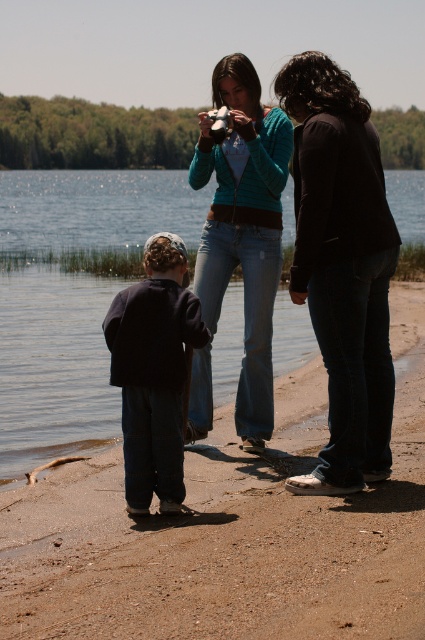
Question: Is black matte pants at right bigger than dark blue fabric at center?

Choices:
 (A) no
 (B) yes

Answer: (B)

Question: Considering the real-world distances, which object is closest to the dark blue fabric at center?

Choices:
 (A) brown sandy beach at lower center
 (B) black matte pants at right
 (C) jeans at center

Answer: (B)

Question: In this image, where is black matte pants at right located relative to dark blue fabric at center?

Choices:
 (A) left
 (B) right

Answer: (B)

Question: Which point is farther to the camera?

Choices:
 (A) (362, 102)
 (B) (107, 540)
 (C) (130, 356)

Answer: (A)

Question: Does brown sandy beach at lower center appear under jeans at center?

Choices:
 (A) no
 (B) yes

Answer: (B)

Question: Among these points, which one is farthest from the camera?

Choices:
 (A) [129, 467]
 (B) [300, 148]

Answer: (A)